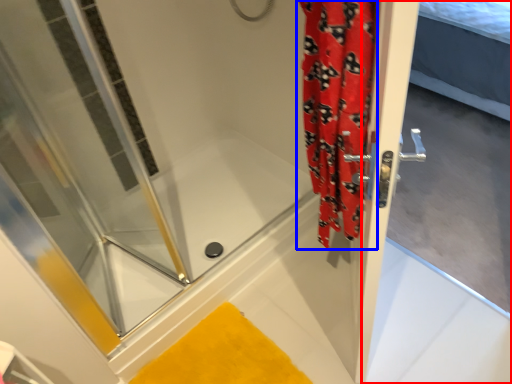
Question: Which object appears farthest to the camera in this image, screen door (highlighted by a red box) or shower curtain (highlighted by a blue box)?

Choices:
 (A) screen door
 (B) shower curtain

Answer: (A)